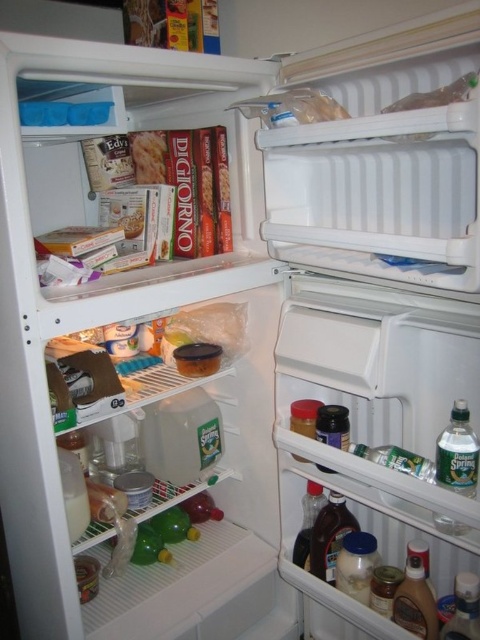
Question: Is clear plastic water at lower right bigger than dark brown glass at lower center?

Choices:
 (A) yes
 (B) no

Answer: (A)

Question: Which point appears farthest from the camera in this image?

Choices:
 (A) (451, 435)
 (B) (333, 570)

Answer: (B)

Question: Is clear plastic water at lower right positioned at the back of dark brown glass at lower center?

Choices:
 (A) yes
 (B) no

Answer: (B)

Question: Among these points, which one is farthest from the camera?

Choices:
 (A) (319, 544)
 (B) (447, 454)

Answer: (A)

Question: Is clear plastic water at lower right above dark brown glass at lower center?

Choices:
 (A) no
 (B) yes

Answer: (B)